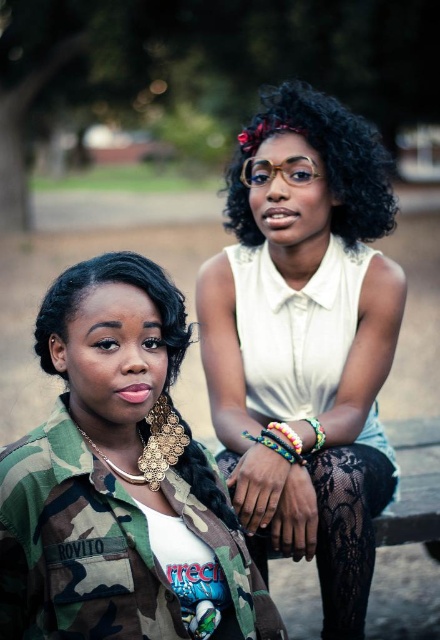
You are standing in the park and see two points marked in the image. Which point, point (117, 292) or point (289, 442), is closer to you?

Point (117, 292) is closer to the viewer than point (289, 442).